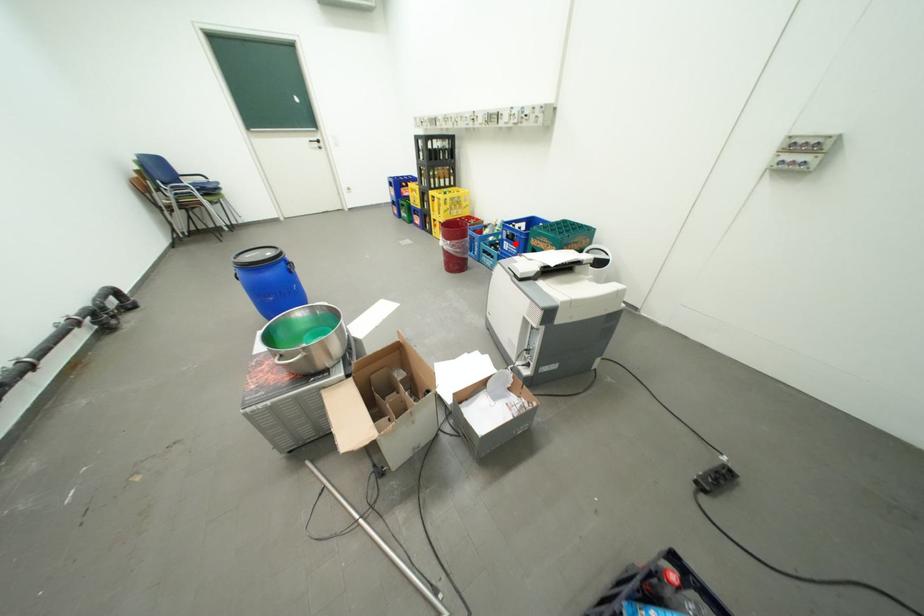
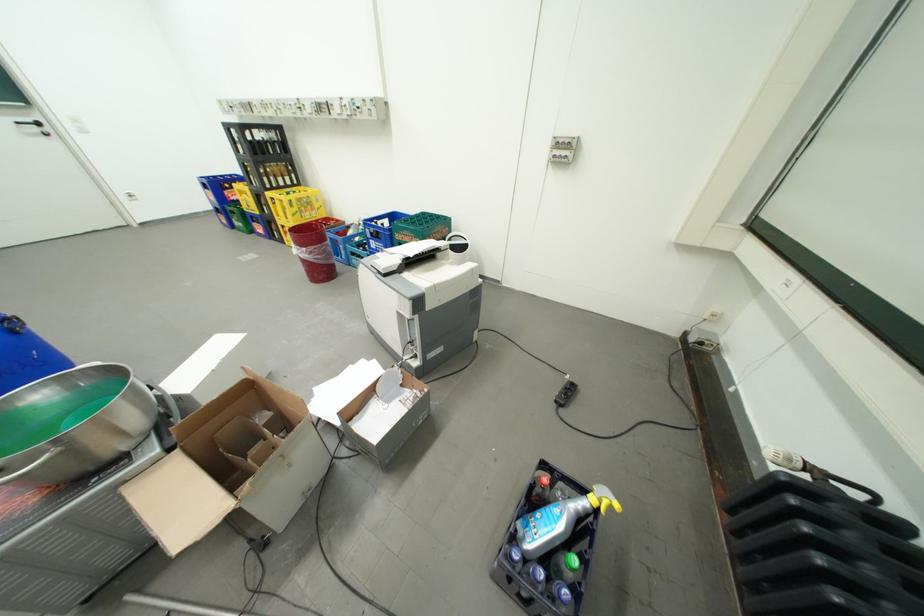
Find the pixel in the second image that matches the highlighted location in the first image.

(381, 241)